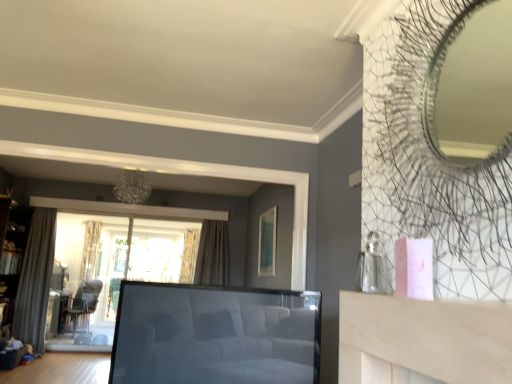
Question: Is patterned fabric curtain at center, which ranks as the 1th curtain in back-to-front order, oriented away from matte green picture frame at upper center?

Choices:
 (A) no
 (B) yes

Answer: (A)

Question: Does patterned fabric curtain at center, the 3th curtain in the left-to-right sequence, have a smaller size compared to matte green picture frame at upper center?

Choices:
 (A) no
 (B) yes

Answer: (A)

Question: Is patterned fabric curtain at center, which ranks as the 1th curtain in back-to-front order, positioned in front of matte green picture frame at upper center?

Choices:
 (A) yes
 (B) no

Answer: (B)

Question: Is there a large distance between patterned fabric curtain at center, which ranks as the 1th curtain in back-to-front order, and matte green picture frame at upper center?

Choices:
 (A) yes
 (B) no

Answer: (A)

Question: Considering the relative sizes of patterned fabric curtain at center, the 3th curtain in the left-to-right sequence, and matte green picture frame at upper center in the image provided, is patterned fabric curtain at center, the 3th curtain in the left-to-right sequence, wider than matte green picture frame at upper center?

Choices:
 (A) yes
 (B) no

Answer: (A)

Question: Considering the positions of white leather studio couch at center and wooden bookshelf at left in the image, is white leather studio couch at center bigger or smaller than wooden bookshelf at left?

Choices:
 (A) small
 (B) big

Answer: (A)

Question: Do you think white leather studio couch at center is within wooden bookshelf at left, or outside of it?

Choices:
 (A) outside
 (B) inside

Answer: (A)

Question: Is point pyautogui.click(x=287, y=354) positioned closer to the camera than point pyautogui.click(x=8, y=311)?

Choices:
 (A) farther
 (B) closer

Answer: (B)

Question: From the image's perspective, is white leather studio couch at center above or below wooden bookshelf at left?

Choices:
 (A) below
 (B) above

Answer: (B)

Question: Considering the positions of point (188, 283) and point (20, 256), is point (188, 283) closer or farther from the camera than point (20, 256)?

Choices:
 (A) farther
 (B) closer

Answer: (A)

Question: Considering the relative positions of patterned fabric curtain at center, marked as the second curtain in a right-to-left arrangement, and wooden bookshelf at left in the image provided, is patterned fabric curtain at center, marked as the second curtain in a right-to-left arrangement, to the left or to the right of wooden bookshelf at left?

Choices:
 (A) left
 (B) right

Answer: (B)

Question: From a real-world perspective, is patterned fabric curtain at center, the 4th curtain when ordered from front to back, physically located above or below wooden bookshelf at left?

Choices:
 (A) above
 (B) below

Answer: (A)

Question: Considering the positions of patterned fabric curtain at center, the 4th curtain when ordered from front to back, and wooden bookshelf at left in the image, is patterned fabric curtain at center, the 4th curtain when ordered from front to back, wider or thinner than wooden bookshelf at left?

Choices:
 (A) wide
 (B) thin

Answer: (B)

Question: Is wooden bookshelf at left to the left or to the right of dark brown leather armchair at lower left in the image?

Choices:
 (A) left
 (B) right

Answer: (A)

Question: Looking at their shapes, would you say wooden bookshelf at left is wider or thinner than dark brown leather armchair at lower left?

Choices:
 (A) wide
 (B) thin

Answer: (B)